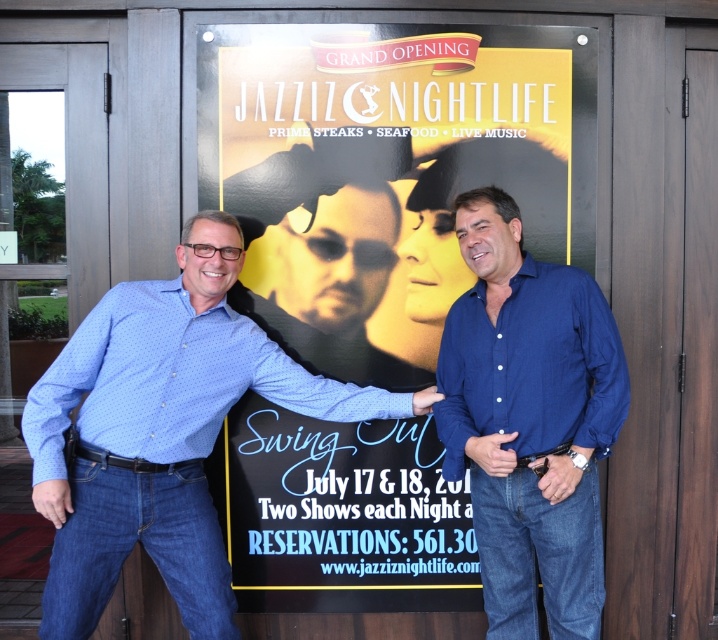
What are the coordinates of the blue dotted shirt at left?

The blue dotted shirt at left is located at coordinates point (162, 433).

You are a delivery person who needs to place a package between the yellow paper poster at center and the blue dotted shirt at left. The package is 15 inches long. Can you fit it between them without moving either object?

The distance between the yellow paper poster at center and the blue dotted shirt at left is 14.64 inches. Since the package is 15 inches long, which is slightly longer than the available space, it cannot be placed between them without moving either object.